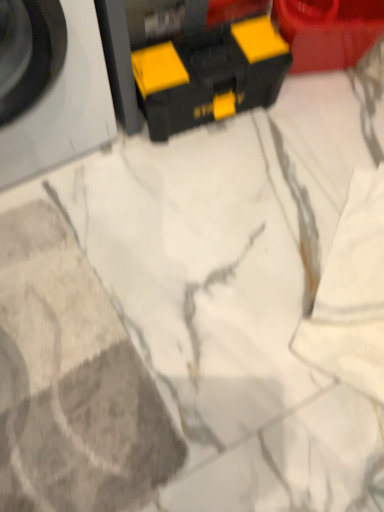
Find the location of a particular element. The image size is (384, 512). black plastic toolbox at upper center is located at coordinates (188, 64).

The height and width of the screenshot is (512, 384). Describe the element at coordinates (188, 64) in the screenshot. I see `black plastic toolbox at upper center` at that location.

In order to face black plastic toolbox at upper center, should I rotate leftwards or rightwards?

A 2.041 degree turn to the right will do.

Locate an element on the screen. The image size is (384, 512). white matte washing machine at left is located at coordinates (50, 86).

What do you see at coordinates (50, 86) in the screenshot? The image size is (384, 512). I see `white matte washing machine at left` at bounding box center [50, 86].

At what (x,y) coordinates should I click in order to perform the action: click on black plastic toolbox at upper center. Please return your answer as a coordinate pair (x, y). The width and height of the screenshot is (384, 512). Looking at the image, I should click on (188, 64).

Considering the positions of objects white matte washing machine at left and black plastic toolbox at upper center in the image provided, who is more to the right, white matte washing machine at left or black plastic toolbox at upper center?

Positioned to the right is black plastic toolbox at upper center.

Which object is closer to the camera taking this photo, white matte washing machine at left or black plastic toolbox at upper center?

white matte washing machine at left is more forward.

Considering the positions of point (17, 67) and point (176, 116), is point (17, 67) closer or farther from the camera than point (176, 116)?

Point (17, 67) appears to be closer to the viewer than point (176, 116).

From the image's perspective, does white matte washing machine at left appear higher than black plastic toolbox at upper center?

Yes, from the image's perspective, white matte washing machine at left is over black plastic toolbox at upper center.

From a real-world perspective, is white matte washing machine at left above or below black plastic toolbox at upper center?

Clearly, from a real-world perspective, white matte washing machine at left is above black plastic toolbox at upper center.

From the picture: Considering the sizes of objects white matte washing machine at left and black plastic toolbox at upper center in the image provided, who is wider, white matte washing machine at left or black plastic toolbox at upper center?

With larger width is white matte washing machine at left.

Can you confirm if white matte washing machine at left is taller than black plastic toolbox at upper center?

Yes.

Can you confirm if white matte washing machine at left is smaller than black plastic toolbox at upper center?

No, white matte washing machine at left is not smaller than black plastic toolbox at upper center.

Is white matte washing machine at left situated inside black plastic toolbox at upper center or outside?

white matte washing machine at left is outside black plastic toolbox at upper center.

Can you see white matte washing machine at left touching black plastic toolbox at upper center?

No.

Does white matte washing machine at left turn towards black plastic toolbox at upper center?

No, white matte washing machine at left does not turn towards black plastic toolbox at upper center.

What's the angular difference between white matte washing machine at left and black plastic toolbox at upper center's facing directions?

The facing directions of white matte washing machine at left and black plastic toolbox at upper center are 4.51 degrees apart.

How distant is white matte washing machine at left from black plastic toolbox at upper center?

7.86 inches.

Locate an element on the screen. washing machine above the black plastic toolbox at upper center (from the image's perspective) is located at coordinates (50, 86).

Can you confirm if black plastic toolbox at upper center is positioned to the right of white matte washing machine at left?

Yes.

Is the depth of black plastic toolbox at upper center less than that of white matte washing machine at left?

That is False.

Between point (132, 4) and point (99, 100), which one is positioned in front?

The point (132, 4) is closer.

From the image's perspective, would you say black plastic toolbox at upper center is positioned over white matte washing machine at left?

No, from the image's perspective, black plastic toolbox at upper center is not over white matte washing machine at left.

From a real-world perspective, is black plastic toolbox at upper center located higher than white matte washing machine at left?

Actually, black plastic toolbox at upper center is physically below white matte washing machine at left in the real world.

Looking at their sizes, would you say black plastic toolbox at upper center is wider or thinner than white matte washing machine at left?

Clearly, black plastic toolbox at upper center has less width compared to white matte washing machine at left.

Who is taller, black plastic toolbox at upper center or white matte washing machine at left?

Standing taller between the two is white matte washing machine at left.

Can you confirm if black plastic toolbox at upper center is bigger than white matte washing machine at left?

Actually, black plastic toolbox at upper center might be smaller than white matte washing machine at left.

Is black plastic toolbox at upper center located outside white matte washing machine at left?

Absolutely, black plastic toolbox at upper center is external to white matte washing machine at left.

Is black plastic toolbox at upper center far away from white matte washing machine at left?

black plastic toolbox at upper center is actually quite close to white matte washing machine at left.

Does black plastic toolbox at upper center turn towards white matte washing machine at left?

No, black plastic toolbox at upper center is not oriented towards white matte washing machine at left.

Can you tell me how much black plastic toolbox at upper center and white matte washing machine at left differ in facing direction?

There is a 4.51-degree angle between the facing directions of black plastic toolbox at upper center and white matte washing machine at left.

How far apart are black plastic toolbox at upper center and white matte washing machine at left?

black plastic toolbox at upper center is 19.97 centimeters away from white matte washing machine at left.

This screenshot has height=512, width=384. What are the coordinates of `toy on the right of white matte washing machine at left` in the screenshot? It's located at (188, 64).

Identify the location of toy lying on the right of white matte washing machine at left. (188, 64).

I want to click on toy that appears below the white matte washing machine at left (from the image's perspective), so click(188, 64).